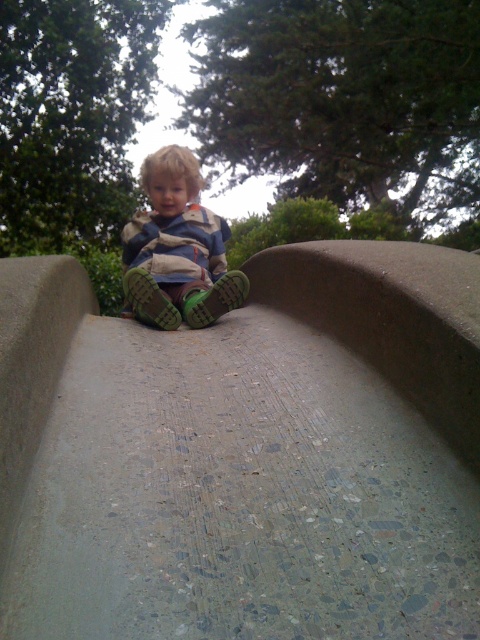
Question: Can you confirm if gray concrete slide at center is positioned to the right of matte green shoes at center?

Choices:
 (A) yes
 (B) no

Answer: (A)

Question: Observing the image, what is the correct spatial positioning of gray concrete slide at center in reference to matte green shoes at center?

Choices:
 (A) above
 (B) below

Answer: (B)

Question: Is the position of gray concrete slide at center more distant than that of matte green shoes at center?

Choices:
 (A) yes
 (B) no

Answer: (B)